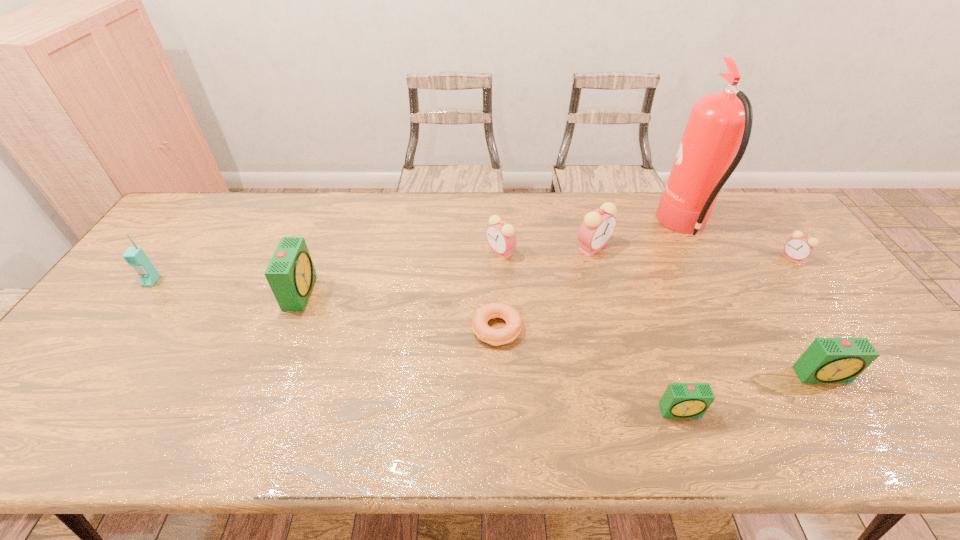
I want to click on the tallest object, so click(x=719, y=124).

Locate an element on the screen. red fire extinguisher is located at coordinates (719, 124).

Image resolution: width=960 pixels, height=540 pixels. I want to click on the leftmost object, so click(135, 256).

Find the location of a particular element. Image resolution: width=960 pixels, height=540 pixels. the biggest pink alarm clock is located at coordinates (598, 226).

Locate an element on the screen. The height and width of the screenshot is (540, 960). the biggest green alarm clock is located at coordinates (291, 274).

Identify the location of the third nearest alarm clock. Image resolution: width=960 pixels, height=540 pixels. (291, 274).

I want to click on the second smallest pink alarm clock, so click(501, 236).

Locate an element on the screen. The width and height of the screenshot is (960, 540). the fifth alarm clock from right to left is located at coordinates (501, 236).

Locate an element on the screen. the second biggest green alarm clock is located at coordinates (827, 360).

Find the location of a particular element. The image size is (960, 540). the second alarm clock from right to left is located at coordinates (827, 360).